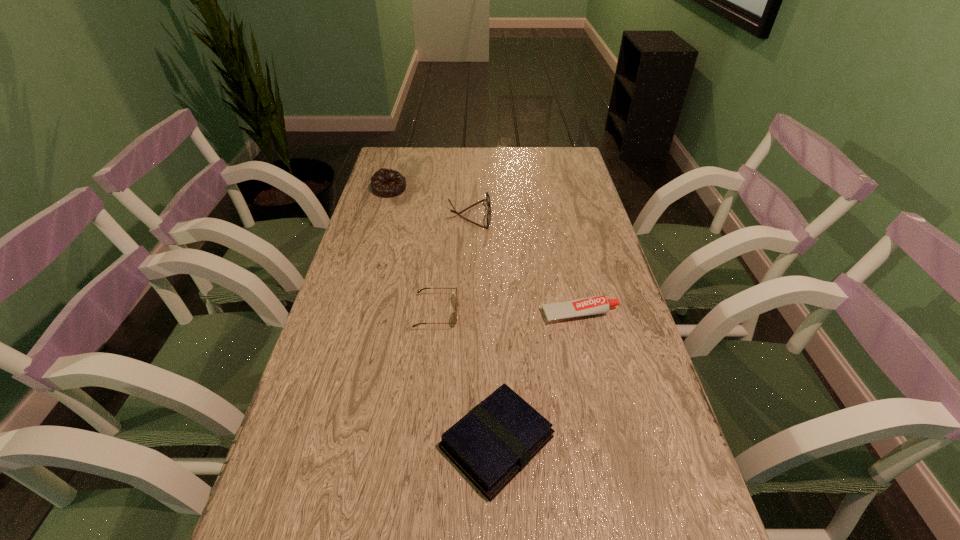
Image resolution: width=960 pixels, height=540 pixels. I want to click on blank space located on the back of the nearest object, so click(x=493, y=343).

Find the location of a particular element. This screenshot has width=960, height=540. free space located 0.320m on the front of the toothpaste is located at coordinates (613, 458).

Identify the location of object at the left edge. (385, 182).

The image size is (960, 540). I want to click on object that is at the right edge, so click(594, 305).

The width and height of the screenshot is (960, 540). Identify the location of free space at the far edge of the desktop. (431, 176).

Where is `blank area at the left edge`? blank area at the left edge is located at coordinates (361, 285).

I want to click on vacant area at the right edge of the desktop, so click(596, 345).

Locate an element on the screen. The image size is (960, 540). free space at the far left corner of the desktop is located at coordinates (400, 169).

Locate an element on the screen. The width and height of the screenshot is (960, 540). vacant region at the far right corner of the desktop is located at coordinates (564, 168).

This screenshot has width=960, height=540. I want to click on free spot between the sunglasses and the toothpaste, so click(x=509, y=313).